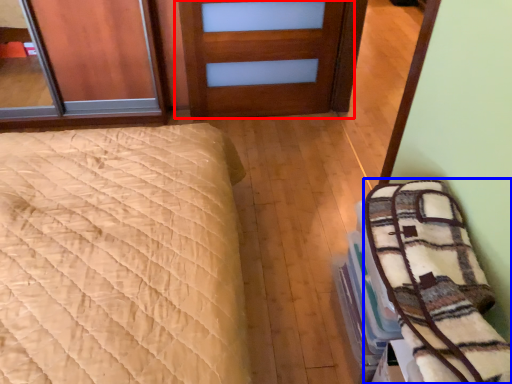
Question: Which object appears farthest to the camera in this image, door (highlighted by a red box) or bedding (highlighted by a blue box)?

Choices:
 (A) door
 (B) bedding

Answer: (A)